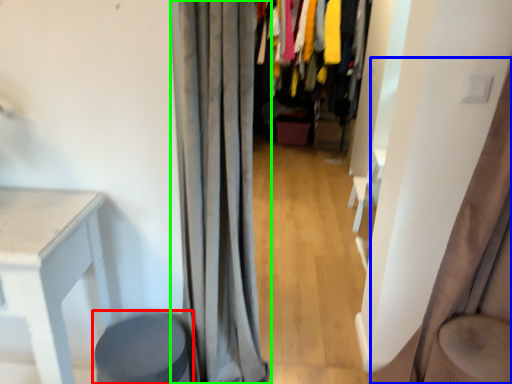
Question: Based on their relative distances, which object is nearer to music stool (highlighted by a red box)? Choose from curtain (highlighted by a blue box) and curtain (highlighted by a green box).

Choices:
 (A) curtain
 (B) curtain

Answer: (B)